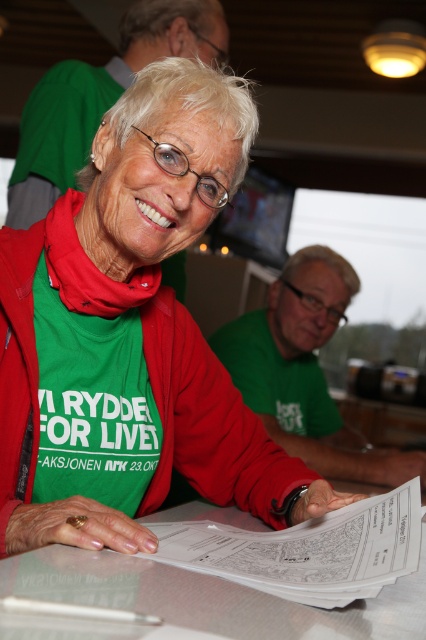
The woman is sitting at the table. Where is the green fabric shirt at center in relation to the white glossy table at center?

The green fabric shirt at center is positioned over the white glossy table at center.

You are a photographer setting up for a portrait. You have a white glossy table at center and a green matte shirt at center in your viewfinder. Which object will appear narrower in your photo?

The white glossy table at center is thinner than the green matte shirt at center, so it will appear narrower in the photo.

You are a photographer standing in front of the white glossy table at center and the green fabric shirt at center. Which object is taller?

The green fabric shirt at center is taller than the white glossy table at center.